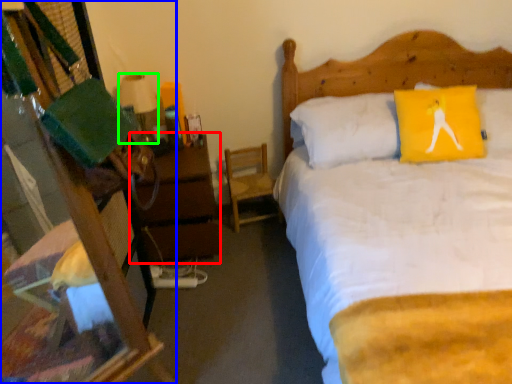
Question: Which is nearer to the nightstand (highlighted by a red box)? desk (highlighted by a blue box) or lamp (highlighted by a green box).

Choices:
 (A) desk
 (B) lamp

Answer: (B)